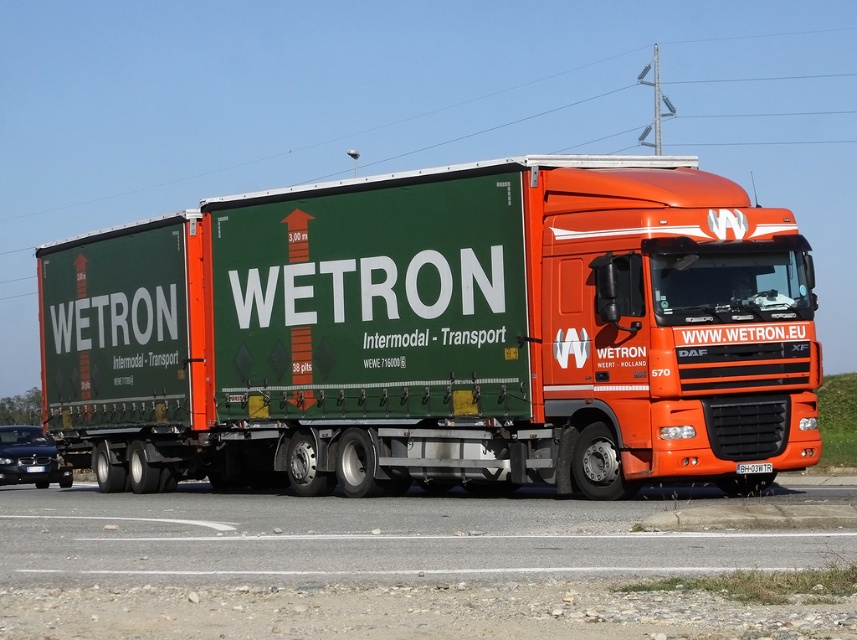
Does green fabric trailer truck at center have a smaller size compared to shiny black sedan at lower left?

Incorrect, green fabric trailer truck at center is not smaller in size than shiny black sedan at lower left.

Can you confirm if green fabric trailer truck at center is wider than shiny black sedan at lower left?

Correct, the width of green fabric trailer truck at center exceeds that of shiny black sedan at lower left.

Does point (770, 452) come behind point (42, 472)?

No.

Identify the location of green fabric trailer truck at center. Image resolution: width=857 pixels, height=640 pixels. (439, 332).

This screenshot has width=857, height=640. Describe the element at coordinates (439, 332) in the screenshot. I see `green fabric trailer truck at center` at that location.

Can you confirm if green fabric trailer truck at center is positioned above black plastic license plate at center?

Yes.

Where is `green fabric trailer truck at center`? This screenshot has height=640, width=857. green fabric trailer truck at center is located at coordinates (439, 332).

Image resolution: width=857 pixels, height=640 pixels. What are the coordinates of `green fabric trailer truck at center` in the screenshot? It's located at (439, 332).

Which is in front, point (768, 472) or point (31, 467)?

Point (768, 472) is in front.

Identify the location of red plastic license plate at center. (753, 467).